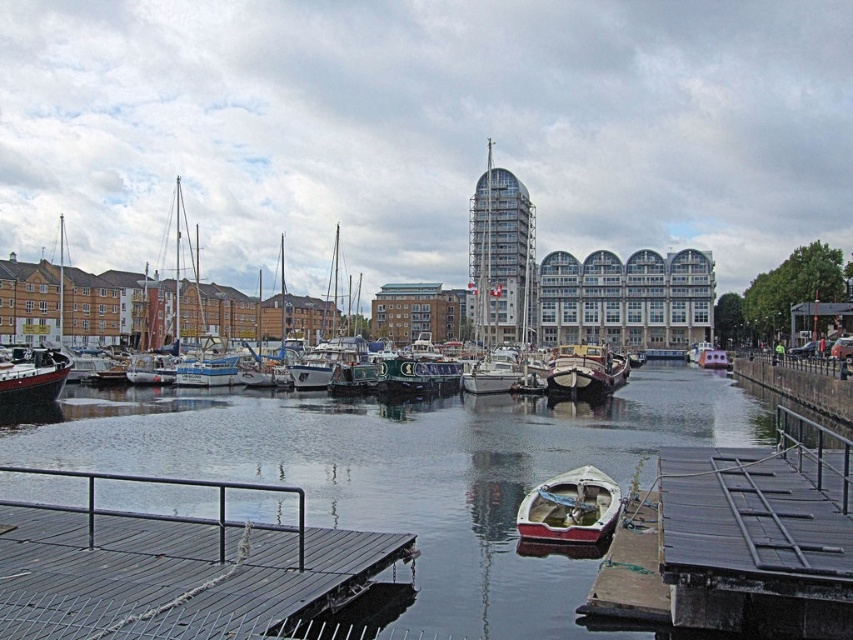
You are standing at the edge of the marina and want to determine which point is nearer to you. The points are labeled as point 1 at coordinates point (76, 621) and point 2 at coordinates point (589, 524). Which point is closer to your current position?

Point (76, 621) is closer to the viewer than point (589, 524), so point 1 is closer to your current position.